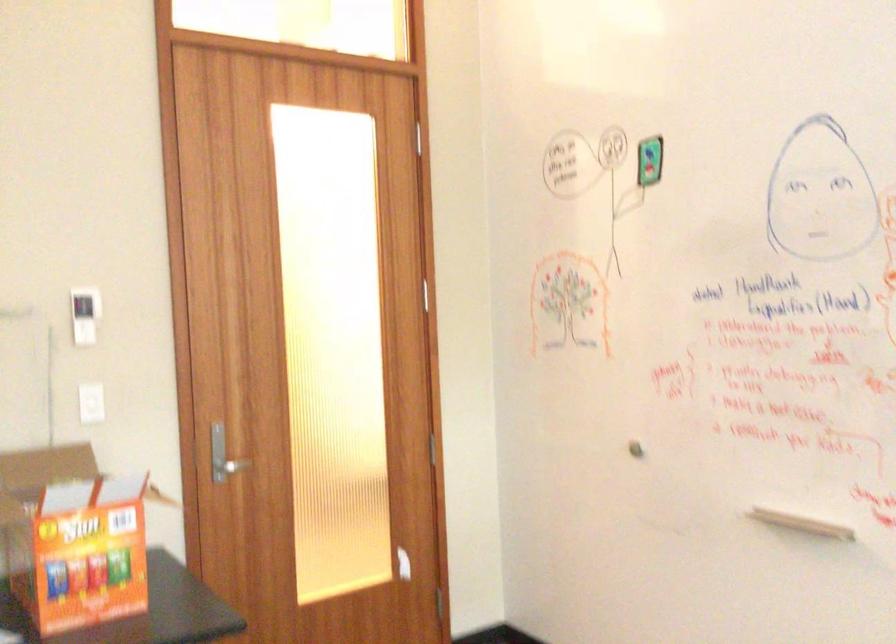
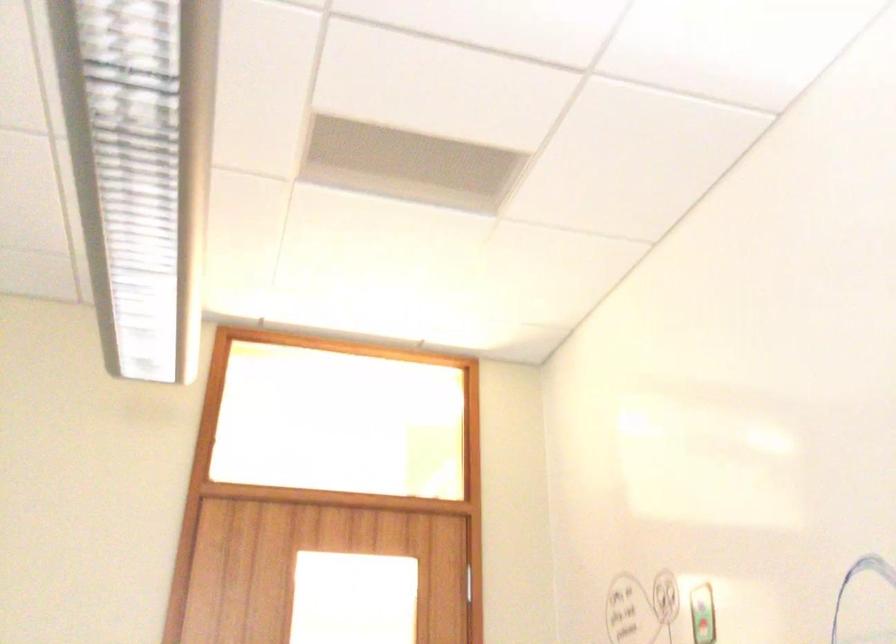
The first image is from the beginning of the video and the second image is from the end. How did the camera likely rotate when shooting the video?

The camera's rotation is toward left-up.